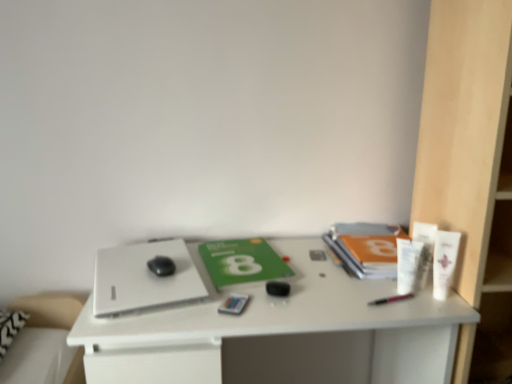
Locate an element on the screen. Image resolution: width=512 pixels, height=384 pixels. free space to the left of black plastic pen at center, which is counted as the 2th stationery, starting from the left is located at coordinates (325, 297).